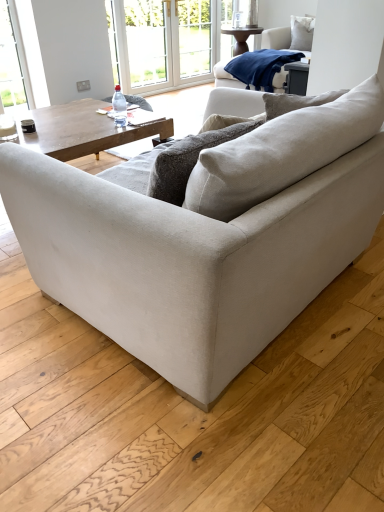
What is the approximate height of white plastic window frame at upper center?

white plastic window frame at upper center is 3.44 feet in height.

What do you see at coordinates (194, 36) in the screenshot? I see `white glass screen door at upper center` at bounding box center [194, 36].

The height and width of the screenshot is (512, 384). Identify the location of white glass screen door at upper center. (194, 36).

Locate an element on the screen. The width and height of the screenshot is (384, 512). white plastic window frame at upper center is located at coordinates pos(163,42).

Image resolution: width=384 pixels, height=512 pixels. In order to click on window frame on the left of white glass screen door at upper center in this screenshot , I will do `click(163, 42)`.

From the image's perspective, is white plastic window frame at upper center located above or below white glass screen door at upper center?

Based on their image positions, white plastic window frame at upper center is located beneath white glass screen door at upper center.

From a real-world perspective, is white plastic window frame at upper center located beneath white glass screen door at upper center?

Yes, from a real-world perspective, white plastic window frame at upper center is beneath white glass screen door at upper center.

Based on the photo, is white glossy coffee cup at upper left at the right side of white plastic window frame at upper center?

Incorrect, white glossy coffee cup at upper left is not on the right side of white plastic window frame at upper center.

Is white glossy coffee cup at upper left outside of white plastic window frame at upper center?

Yes, white glossy coffee cup at upper left is outside of white plastic window frame at upper center.

From the image's perspective, is white glossy coffee cup at upper left above or below white plastic window frame at upper center?

Based on their image positions, white glossy coffee cup at upper left is located beneath white plastic window frame at upper center.

Can you confirm if white glossy coffee cup at upper left is shorter than white plastic window frame at upper center?

Correct, white glossy coffee cup at upper left is not as tall as white plastic window frame at upper center.

Between white plastic window frame at upper center and transparent plastic window screen at upper center, which one has less height?

transparent plastic window screen at upper center.

Considering the positions of objects white plastic window frame at upper center and transparent plastic window screen at upper center in the image provided, who is in front, white plastic window frame at upper center or transparent plastic window screen at upper center?

transparent plastic window screen at upper center is closer to the camera.

In the scene shown: From a real-world perspective, who is located higher, white plastic window frame at upper center or transparent plastic window screen at upper center?

From a 3D spatial view, transparent plastic window screen at upper center is above.

From the image's perspective, does white plastic window frame at upper center appear lower than transparent plastic window screen at upper center?

No, from the image's perspective, white plastic window frame at upper center is not below transparent plastic window screen at upper center.

Between transparent plastic window screen at upper center and navy blue fleece blanket at upper right, which one has larger size?

navy blue fleece blanket at upper right is bigger.

Is point (143, 41) closer to viewer compared to point (250, 73)?

No.

Find the location of a particular element. Image resolution: width=384 pixels, height=512 pixels. window screen to the left of navy blue fleece blanket at upper right is located at coordinates (146, 41).

Does white glass screen door at upper center have a greater width compared to transparent plastic bottle at center?

Correct, the width of white glass screen door at upper center exceeds that of transparent plastic bottle at center.

Locate an element on the screen. The height and width of the screenshot is (512, 384). screen door behind the transparent plastic bottle at center is located at coordinates (194, 36).

Considering the positions of objects white glass screen door at upper center and transparent plastic bottle at center in the image provided, who is more to the right, white glass screen door at upper center or transparent plastic bottle at center?

From the viewer's perspective, white glass screen door at upper center appears more on the right side.

From the image's perspective, who appears lower, white glossy coffee cup at upper left or navy blue fleece blanket at upper right?

From the image's view, white glossy coffee cup at upper left is below.

Is white glossy coffee cup at upper left not near navy blue fleece blanket at upper right?

Yes, white glossy coffee cup at upper left and navy blue fleece blanket at upper right are located far from each other.

Locate an element on the screen. This screenshot has height=512, width=384. material that is on the right side of white glossy coffee cup at upper left is located at coordinates (260, 66).

Who is bigger, white glossy coffee cup at upper left or navy blue fleece blanket at upper right?

navy blue fleece blanket at upper right.

What are the coordinates of `screen door below the transparent plastic window screen at upper center (from a real-world perspective)` in the screenshot? It's located at (194, 36).

Considering the relative sizes of white glass screen door at upper center and transparent plastic window screen at upper center in the image provided, is white glass screen door at upper center bigger than transparent plastic window screen at upper center?

Incorrect, white glass screen door at upper center is not larger than transparent plastic window screen at upper center.

Based on their positions, is white glass screen door at upper center located to the left or right of transparent plastic window screen at upper center?

Based on their positions, white glass screen door at upper center is located to the right of transparent plastic window screen at upper center.

Locate an element on the screen. screen door lying behind the white plastic window frame at upper center is located at coordinates (x=194, y=36).

Identify the location of coffee cup that is below the white plastic window frame at upper center (from the image's perspective). This screenshot has width=384, height=512. (8, 128).

Estimate the real-world distances between objects in this image. Which object is further from white glass screen door at upper center, navy blue fleece blanket at upper right or transparent plastic bottle at center?

Based on the image, transparent plastic bottle at center appears to be further to white glass screen door at upper center.

When comparing their distances from white glossy coffee cup at upper left, does transparent plastic bottle at center or white soft cushion at upper right seem further?

Based on the image, white soft cushion at upper right appears to be further to white glossy coffee cup at upper left.

From the image, which object appears to be farther from transparent plastic bottle at center, transparent plastic window screen at upper center or white glossy coffee cup at upper left?

Among the two, transparent plastic window screen at upper center is located further to transparent plastic bottle at center.

Looking at the image, which one is located closer to navy blue fleece blanket at upper right, white glossy coffee cup at upper left or beige fabric couch at center?

white glossy coffee cup at upper left.

Looking at the image, which one is located further to white glass screen door at upper center, white soft cushion at upper right or white glossy coffee cup at upper left?

Based on the image, white glossy coffee cup at upper left appears to be further to white glass screen door at upper center.

When comparing their distances from transparent plastic window screen at upper center, does transparent plastic bottle at center or white soft cushion at upper right seem further?

transparent plastic bottle at center lies further to transparent plastic window screen at upper center than the other object.

Estimate the real-world distances between objects in this image. Which object is closer to white soft cushion at upper right, transparent plastic window screen at upper center or beige fabric couch at center?

transparent plastic window screen at upper center is closer to white soft cushion at upper right.

When comparing their distances from beige fabric couch at center, does navy blue fleece blanket at upper right or white glossy coffee cup at upper left seem further?

navy blue fleece blanket at upper right is further to beige fabric couch at center.

This screenshot has height=512, width=384. Find the location of `window screen between white glossy coffee cup at upper left and white plastic window frame at upper center from front to back`. window screen between white glossy coffee cup at upper left and white plastic window frame at upper center from front to back is located at coordinates (146, 41).

This screenshot has width=384, height=512. I want to click on screen door between white plastic window frame at upper center and navy blue fleece blanket at upper right from left to right, so click(x=194, y=36).

Where is `material between beige fabric couch at center and white glass screen door at upper center from front to back`? material between beige fabric couch at center and white glass screen door at upper center from front to back is located at coordinates (260, 66).

The height and width of the screenshot is (512, 384). Identify the location of material located between white glossy coffee cup at upper left and white soft cushion at upper right in the depth direction. (260, 66).